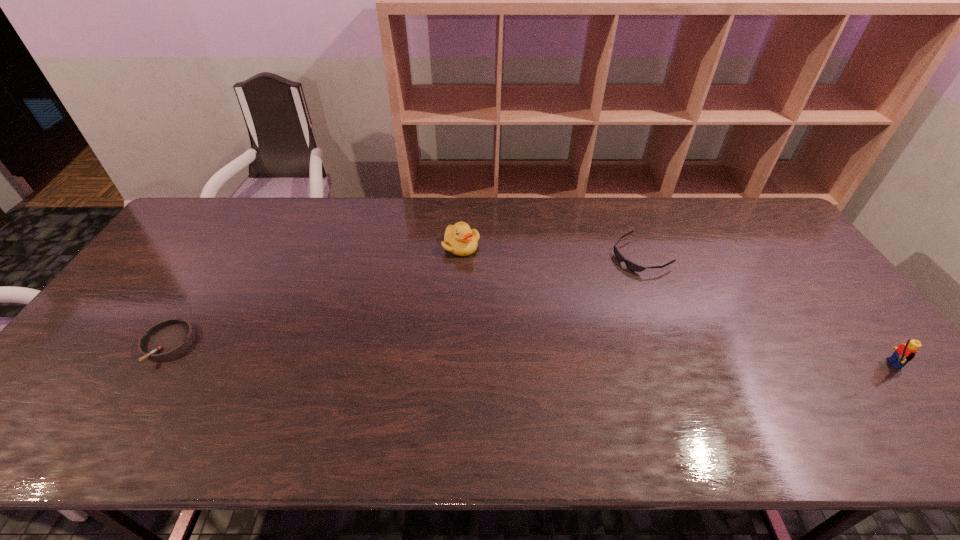
Locate an element on the screen. unoccupied area between the second object from right to left and the second tallest object is located at coordinates (551, 251).

Where is `free space between the third object from right to left and the rightmost object`? free space between the third object from right to left and the rightmost object is located at coordinates (673, 305).

Identify the location of empty space that is in between the second tallest object and the shortest object. This screenshot has width=960, height=540. (551, 251).

Locate an element on the screen. empty space that is in between the sunglasses and the ashtray is located at coordinates (404, 300).

Locate an element on the screen. The image size is (960, 540). vacant area that lies between the tallest object and the second object from left to right is located at coordinates (673, 305).

I want to click on vacant space that is in between the second object from right to left and the third object from right to left, so click(551, 251).

This screenshot has width=960, height=540. Identify the location of free space between the second shortest object and the third object from right to left. (314, 295).

Find the location of a particular element. The width and height of the screenshot is (960, 540). vacant space in between the rightmost object and the second shortest object is located at coordinates (526, 354).

The width and height of the screenshot is (960, 540). I want to click on empty space that is in between the second object from right to left and the Lego, so click(763, 309).

Find the location of a particular element. This screenshot has width=960, height=540. object that ranks as the third closest to the second object from left to right is located at coordinates point(905,352).